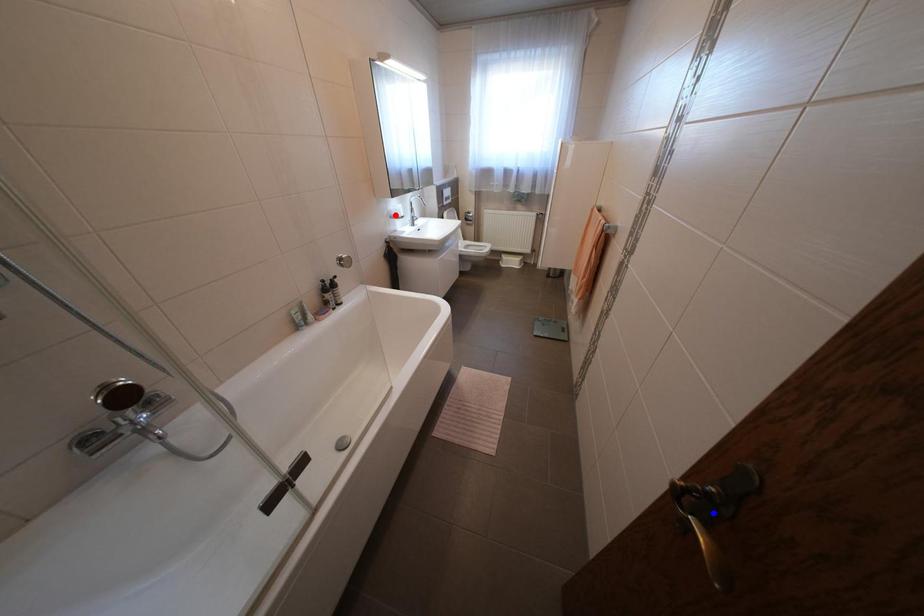
Question: In the image, two points are highlighted. Which point is nearer to the camera? Reply with the corresponding letter.

Choices:
 (A) blue point
 (B) red point

Answer: (A)